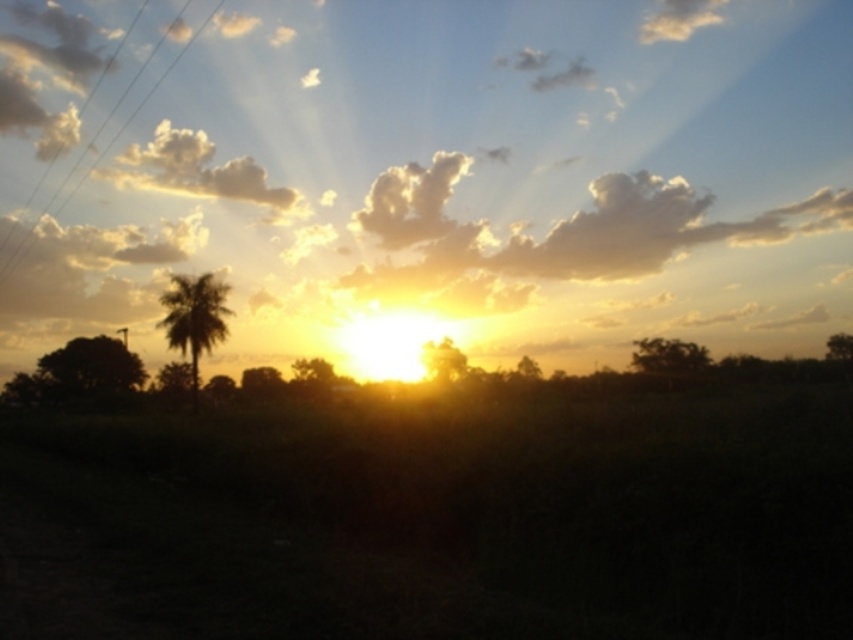
You are a photographer standing at the camera position in this sunset scene. You want to capture a closeup shot of the white fluffy cloud at upper center. Given that your telephoto lens can focus on objects up to 300 feet away, will you need to adjust your equipment to get a clear image?

The white fluffy cloud at upper center is 336.14 feet away from the camera, which exceeds the telephoto lens maximum focus range of 300 feet. You will need to use a longer telephoto lens or a camera with greater zoom capability to capture a clear closeup.

You are an astronomer observing the sunset and notice two clouds in the sky. Which of the two clouds, the white fluffy cloud at upper left or the white fluffy cloud at upper center, is positioned further to the east?

The white fluffy cloud at upper left is positioned further to the east because it is to the left of the white fluffy cloud at upper center, and since the sun is setting in the west, the left side of the image corresponds to the eastern direction.